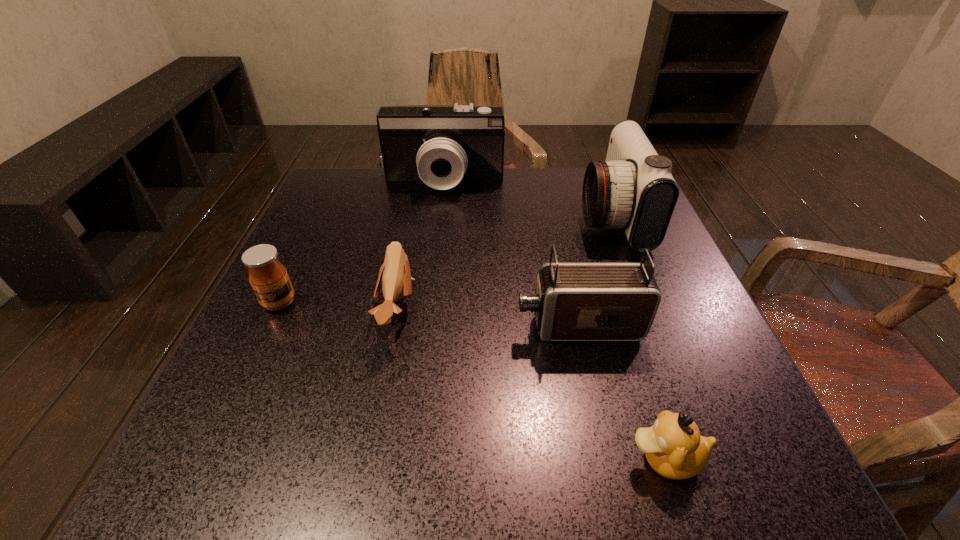
Locate an element on the screen. the leftmost camcorder is located at coordinates (440, 145).

Where is `the nearest camcorder`? Image resolution: width=960 pixels, height=540 pixels. the nearest camcorder is located at coordinates (573, 301).

Find the location of a particular element. The height and width of the screenshot is (540, 960). honey is located at coordinates (268, 277).

Locate an element on the screen. bird is located at coordinates (394, 279).

Find the location of `duckling`. duckling is located at coordinates (673, 446).

Identify the location of free space located 0.290m on the lens of the leftmost camcorder. (434, 277).

Locate an element on the screen. vacant space located 0.150m at the lens of the nearest camcorder is located at coordinates (430, 326).

Where is `vacant space situated at the lens of the nearest camcorder`? The width and height of the screenshot is (960, 540). vacant space situated at the lens of the nearest camcorder is located at coordinates (354, 326).

The height and width of the screenshot is (540, 960). In order to click on free spot located 0.050m at the lens of the nearest camcorder in this screenshot , I will do `click(488, 326)`.

Find the location of a particular element. free spot located on the front-facing side of the leftmost object is located at coordinates (233, 399).